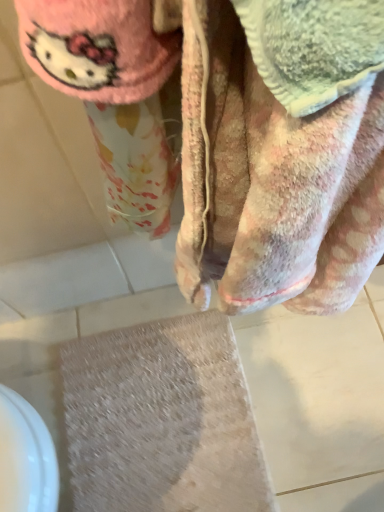
Question: Should I look upward or downward to see beige textured bath mat at lower center?

Choices:
 (A) up
 (B) down

Answer: (B)